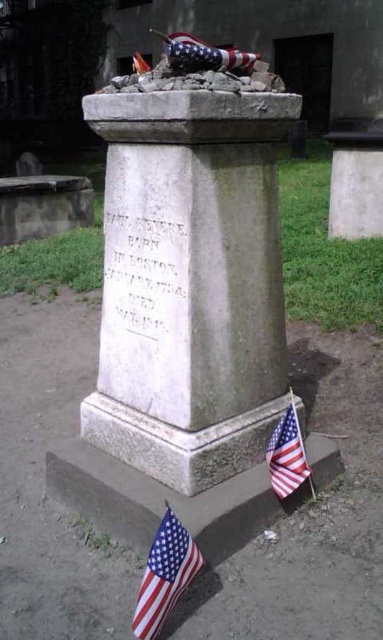
You are a visitor at the cemetery and want to place a new flag at the monument. The monument has an american flag at top and an american flag at lower right. Where should you place your new flag so it is in front of both existing flags?

You should place your new flag in front of both the american flag at top and the american flag at lower right since the american flag at top is behind the american flag at lower right.

You are a visitor at the cemetery and want to place a small bouquet of flowers. The bouquet is the same size as the american flag at lower right. Where should you place it so that it is visible next to the white stone monument at center without being overshadowed by the monument?

The white stone monument at center is larger in size than the american flag at lower right. To ensure visibility, place the bouquet near the base of the monument, similar to where the existing american flag at lower right is positioned, so it won not be overshadowed by the monument.